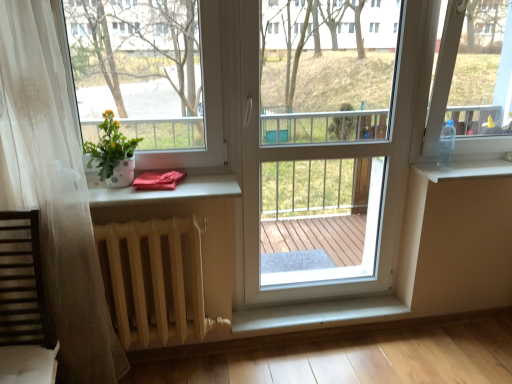
Question: Could you tell me if white glossy pot at left is facing wooden slats rocking chair at lower left?

Choices:
 (A) no
 (B) yes

Answer: (A)

Question: From a real-world perspective, is white glossy pot at left physically below wooden slats rocking chair at lower left?

Choices:
 (A) no
 (B) yes

Answer: (A)

Question: From a real-world perspective, is white glossy pot at left located higher than wooden slats rocking chair at lower left?

Choices:
 (A) yes
 (B) no

Answer: (A)

Question: Is white glossy pot at left wider than wooden slats rocking chair at lower left?

Choices:
 (A) yes
 (B) no

Answer: (B)

Question: Is white glossy pot at left thinner than wooden slats rocking chair at lower left?

Choices:
 (A) no
 (B) yes

Answer: (B)

Question: Is white glossy flower pot at left, which is counted as the 2th window screen, starting from the right, inside the boundaries of white plastic screen door at center, or outside?

Choices:
 (A) inside
 (B) outside

Answer: (B)

Question: From the image's perspective, relative to white plastic screen door at center, is white glossy flower pot at left, which is counted as the 2th window screen, starting from the right, above or below?

Choices:
 (A) below
 (B) above

Answer: (B)

Question: Is white glossy flower pot at left, which is counted as the 2th window screen, starting from the right, taller or shorter than white plastic screen door at center?

Choices:
 (A) short
 (B) tall

Answer: (A)

Question: Is point (106, 36) positioned closer to the camera than point (321, 233)?

Choices:
 (A) farther
 (B) closer

Answer: (B)

Question: From the image's perspective, is wooden slats rocking chair at lower left above or below white glossy flower pot at left, which is counted as the 2th window screen, starting from the right?

Choices:
 (A) below
 (B) above

Answer: (A)

Question: Considering the positions of wooden slats rocking chair at lower left and white glossy flower pot at left, which is the 1th window screen from left to right, in the image, is wooden slats rocking chair at lower left taller or shorter than white glossy flower pot at left, which is the 1th window screen from left to right,?

Choices:
 (A) short
 (B) tall

Answer: (B)

Question: Considering the relative positions of wooden slats rocking chair at lower left and white glossy flower pot at left, which is the 1th window screen from left to right, in the image provided, is wooden slats rocking chair at lower left to the left or to the right of white glossy flower pot at left, which is the 1th window screen from left to right,?

Choices:
 (A) right
 (B) left

Answer: (B)

Question: Looking at their shapes, would you say wooden slats rocking chair at lower left is wider or thinner than white glossy flower pot at left, which is counted as the 2th window screen, starting from the right?

Choices:
 (A) thin
 (B) wide

Answer: (B)

Question: Is point (348, 86) positioned closer to the camera than point (82, 150)?

Choices:
 (A) closer
 (B) farther

Answer: (B)

Question: From the image's perspective, is white plastic screen door at center located above or below white glossy pot at left?

Choices:
 (A) above
 (B) below

Answer: (B)